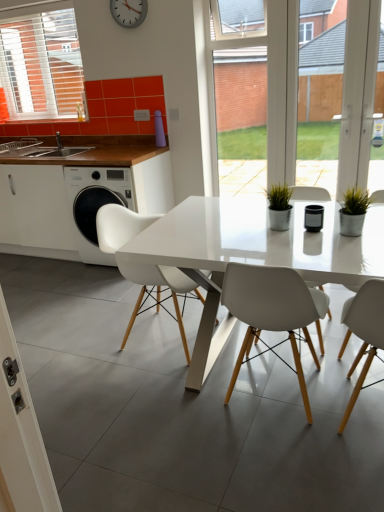
What do you see at coordinates (336, 88) in the screenshot?
I see `transparent glass door at center` at bounding box center [336, 88].

What is the approximate height of white matte cabinet at left?

It is 99.64 centimeters.

Locate an element on the screen. The width and height of the screenshot is (384, 512). white matte chair at center, the second chair from the left is located at coordinates (272, 312).

Describe the element at coordinates (129, 12) in the screenshot. I see `silver metallic clock at upper center` at that location.

I want to click on white plastic chair at center, acting as the first chair starting from the left, so click(159, 292).

Consider the image. Between silver metallic clock at upper center and white matte chair at center, the second chair from the left, which one has larger width?

With larger width is white matte chair at center, the second chair from the left.

Does silver metallic clock at upper center have a smaller size compared to white matte chair at center, positioned as the 1th chair in right-to-left order?

Yes.

How different are the orientations of silver metallic clock at upper center and white matte chair at center, positioned as the 1th chair in right-to-left order, in degrees?

silver metallic clock at upper center and white matte chair at center, positioned as the 1th chair in right-to-left order, are facing 180 degrees away from each other.

Does silver metallic clock at upper center appear on the right side of white matte chair at center, the second chair from the left?

Incorrect, silver metallic clock at upper center is not on the right side of white matte chair at center, the second chair from the left.

Looking at their sizes, would you say white glossy table at center is wider or thinner than silver metallic clock at upper center?

In the image, white glossy table at center appears to be wider than silver metallic clock at upper center.

Would you say white glossy table at center is to the left or to the right of silver metallic clock at upper center in the picture?

white glossy table at center is to the right of silver metallic clock at upper center.

Could you tell me if white glossy table at center is turned towards silver metallic clock at upper center?

No, white glossy table at center is not aimed at silver metallic clock at upper center.

Can you confirm if white plastic chair at center, acting as the first chair starting from the left, is smaller than silver metallic clock at upper center?

No.

From the silver metallic clock at upper center, count 1st chairs forward and point to it. Please provide its 2D coordinates.

[(159, 292)]

From a real-world perspective, which object stands above the other?

silver metallic clock at upper center.

How many degrees apart are the facing directions of white plastic chair at center, which is the second chair in right-to-left order, and silver metallic clock at upper center?

The angle between the facing direction of white plastic chair at center, which is the second chair in right-to-left order, and the facing direction of silver metallic clock at upper center is 90 degrees.

Is white matte chair at center, the second chair from the left, taller than white matte cabinet at left?

No.

Is white matte chair at center, the second chair from the left, positioned beyond the bounds of white matte cabinet at left?

white matte chair at center, the second chair from the left, lies outside white matte cabinet at left's area.

From a real-world perspective, who is located higher, white matte chair at center, the second chair from the left, or white matte cabinet at left?

white matte cabinet at left.

Between white matte chair at center, the second chair from the left, and white matte cabinet at left, which one has larger width?

With larger width is white matte cabinet at left.

In the image, is white glossy table at center positioned in front of or behind white plastic chair at center, acting as the first chair starting from the left?

In the image, white glossy table at center appears in front of white plastic chair at center, acting as the first chair starting from the left.

Considering the sizes of objects white glossy table at center and white plastic chair at center, which is the second chair in right-to-left order, in the image provided, who is shorter, white glossy table at center or white plastic chair at center, which is the second chair in right-to-left order,?

With less height is white glossy table at center.

Are white glossy table at center and white plastic chair at center, which is the second chair in right-to-left order, beside each other?

No, white glossy table at center is not making contact with white plastic chair at center, which is the second chair in right-to-left order.

From a real-world perspective, is white glossy table at center under white plastic chair at center, acting as the first chair starting from the left?

Yes, from a real-world perspective, white glossy table at center is under white plastic chair at center, acting as the first chair starting from the left.

Would you say white matte cabinet at left is inside or outside white glossy table at center?

white matte cabinet at left lies outside white glossy table at center.

From the image's perspective, which is below, white matte cabinet at left or white glossy table at center?

white glossy table at center.

Can you see white matte cabinet at left touching white glossy table at center?

No, white matte cabinet at left is not with white glossy table at center.

Which object is closer to the camera, white matte cabinet at left or white glossy table at center?

Positioned in front is white glossy table at center.

Does point (313, 297) come behind point (128, 12)?

No.

From a real-world perspective, which object stands above the other?

In real-world perspective, silver metallic clock at upper center is above.

Could you tell me if white matte chair at center, positioned as the 1th chair in right-to-left order, is turned towards silver metallic clock at upper center?

No, white matte chair at center, positioned as the 1th chair in right-to-left order, is not facing towards silver metallic clock at upper center.

Locate an element on the screen. the 2nd chair below the silver metallic clock at upper center (from a real-world perspective) is located at coordinates (272, 312).

This screenshot has height=512, width=384. In order to click on clock above the white glossy table at center (from a real-world perspective) in this screenshot , I will do `click(129, 12)`.

Estimate the real-world distances between objects in this image. Which object is closer to white matte chair at center, positioned as the 1th chair in right-to-left order, transparent glass door at center or white matte cabinet at left?

white matte cabinet at left is positioned closer to the anchor white matte chair at center, positioned as the 1th chair in right-to-left order.

Looking at the image, which one is located closer to transparent glass door at center, white glossy table at center or white matte cabinet at left?

white matte cabinet at left is positioned closer to the anchor transparent glass door at center.

Estimate the real-world distances between objects in this image. Which object is closer to transparent glass door at center, white matte cabinet at left or white matte chair at center, positioned as the 1th chair in right-to-left order?

white matte cabinet at left is closer to transparent glass door at center.

When comparing their distances from white plastic chair at center, acting as the first chair starting from the left, does transparent glass door at center or silver metallic clock at upper center seem closer?

Among the two, silver metallic clock at upper center is located nearer to white plastic chair at center, acting as the first chair starting from the left.

Estimate the real-world distances between objects in this image. Which object is closer to white matte cabinet at left, white plastic chair at center, which is the second chair in right-to-left order, or brown wood countertop at left?

brown wood countertop at left is positioned closer to the anchor white matte cabinet at left.

Based on their spatial positions, is white glossy table at center or brown wood countertop at left further from white matte chair at center, the second chair from the left?

brown wood countertop at left is further to white matte chair at center, the second chair from the left.

From the image, which object appears to be farther from transparent glass door at center, white matte chair at center, positioned as the 1th chair in right-to-left order, or white matte cabinet at left?

Among the two, white matte chair at center, positioned as the 1th chair in right-to-left order, is located further to transparent glass door at center.

Based on their spatial positions, is white plastic chair at center, which is the second chair in right-to-left order, or silver metallic clock at upper center closer to white matte cabinet at left?

The object closer to white matte cabinet at left is white plastic chair at center, which is the second chair in right-to-left order.

The width and height of the screenshot is (384, 512). What are the coordinates of `kitchen & dining room table situated between white matte cabinet at left and transparent glass door at center from left to right` in the screenshot? It's located at (251, 255).

In order to click on cabinetry between silver metallic clock at upper center and white matte chair at center, positioned as the 1th chair in right-to-left order, in the up-down direction in this screenshot , I will do `click(76, 191)`.

Find the location of a particular element. cabinetry between silver metallic clock at upper center and white plastic chair at center, which is the second chair in right-to-left order, vertically is located at coordinates (76, 191).

The height and width of the screenshot is (512, 384). Find the location of `chair between silver metallic clock at upper center and white matte chair at center, the second chair from the left, in the vertical direction`. chair between silver metallic clock at upper center and white matte chair at center, the second chair from the left, in the vertical direction is located at coordinates point(159,292).